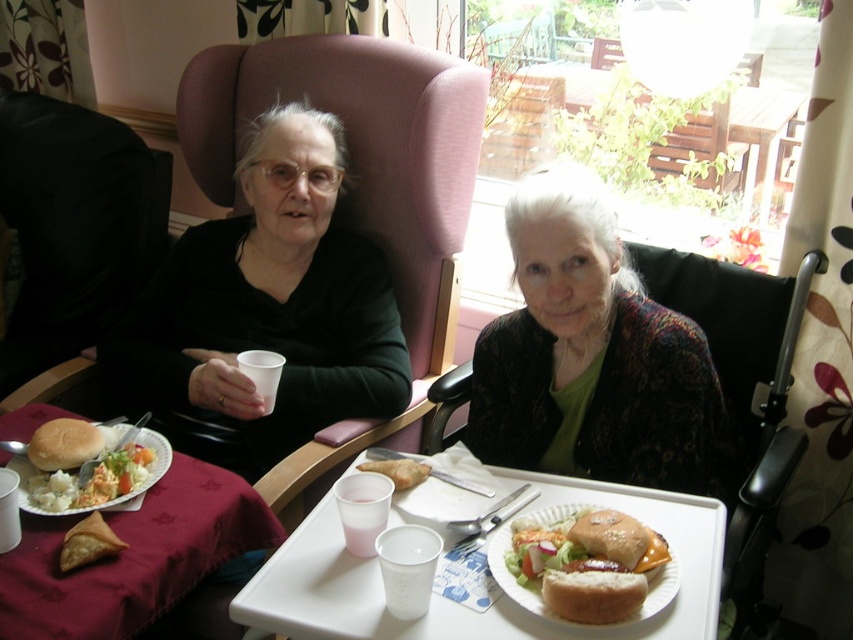
You are a nurse in a care facility and need to locate the matte black cup at left. According to the coordinates provided, where should you look to find it?

The matte black cup at left is located at point (73, 227).

You are a caregiver in the scene and need to place both the matte black cup at left and the golden brown crispy chicken leg at center on a small tray that can only hold items of equal height. Which item should you adjust to ensure they can both fit?

The matte black cup at left has a greater height compared to the golden brown crispy chicken leg at center. To fit both on the tray, you should lower the height of the matte black cup at left to match the height of the golden brown crispy leg at center.

You are standing in the room and want to determine the relative positions of two points marked in the scene. Which point is closer to you, point 1 at coordinates (648, 333) or point 2 at coordinates (688, 545)?

Point 1 at coordinates (648, 333) is closer to you than point 2 at coordinates (688, 545) because it is further to the viewer according to the description.